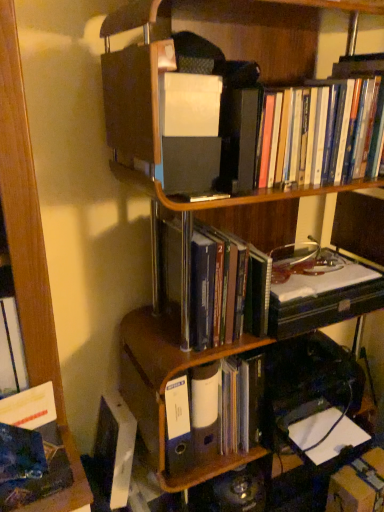
Question: In which direction should I rotate to look at matte plastic binder at center, placed as the third book when sorted from top to bottom?

Choices:
 (A) left
 (B) right

Answer: (B)

Question: From a real-world perspective, does hardcover books at center, acting as the 2th book starting from the bottom, sit lower than blue plastic ring binder at center?

Choices:
 (A) no
 (B) yes

Answer: (A)

Question: Can we say hardcover books at center, acting as the 2th book starting from the bottom, lies outside blue plastic ring binder at center?

Choices:
 (A) no
 (B) yes

Answer: (B)

Question: From the image's perspective, is hardcover books at center, which ranks as the 2th book in top-to-bottom order, on top of blue plastic ring binder at center?

Choices:
 (A) no
 (B) yes

Answer: (B)

Question: Does hardcover books at center, acting as the 2th book starting from the bottom, appear on the left side of blue plastic ring binder at center?

Choices:
 (A) no
 (B) yes

Answer: (A)

Question: Is hardcover books at center, which ranks as the 2th book in top-to-bottom order, oriented away from blue plastic ring binder at center?

Choices:
 (A) yes
 (B) no

Answer: (B)

Question: Is hardcover books at center, acting as the 2th book starting from the bottom, positioned in front of blue plastic ring binder at center?

Choices:
 (A) yes
 (B) no

Answer: (A)

Question: Is cardboard box at lower right turned away from hardcover books at upper right, the third book from the bottom?

Choices:
 (A) yes
 (B) no

Answer: (B)

Question: Is cardboard box at lower right thinner than hardcover books at upper right, the third book from the bottom?

Choices:
 (A) yes
 (B) no

Answer: (A)

Question: Are cardboard box at lower right and hardcover books at upper right, which appears as the first book when viewed from the top, making contact?

Choices:
 (A) no
 (B) yes

Answer: (A)

Question: Is cardboard box at lower right further to camera compared to hardcover books at upper right, the third book from the bottom?

Choices:
 (A) yes
 (B) no

Answer: (A)

Question: Is cardboard box at lower right bigger than hardcover books at upper right, the third book from the bottom?

Choices:
 (A) no
 (B) yes

Answer: (A)

Question: Is cardboard box at lower right to the right of hardcover books at upper right, which appears as the first book when viewed from the top, from the viewer's perspective?

Choices:
 (A) yes
 (B) no

Answer: (A)

Question: Is blue plastic ring binder at center at the back of hardcover books at upper right, the third book from the bottom?

Choices:
 (A) yes
 (B) no

Answer: (B)